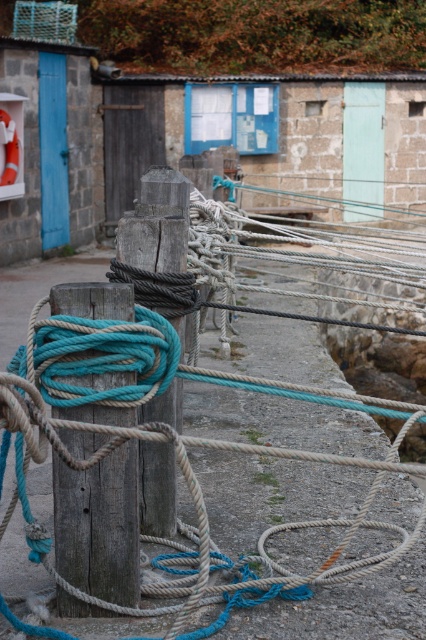
Question: Which point is closer to the camera?

Choices:
 (A) weathered wood post at center
 (B) wooden post at center
 (C) teal rope at center

Answer: (C)

Question: Can you confirm if teal rope at center is positioned to the right of weathered wood post at center?

Choices:
 (A) no
 (B) yes

Answer: (B)

Question: Which object is farther from the camera taking this photo?

Choices:
 (A) weathered wood post at center
 (B) wooden post at center

Answer: (A)

Question: Among these points, which one is nearest to the camera?

Choices:
 (A) (89, 451)
 (B) (178, 220)
 (C) (201, 589)

Answer: (C)

Question: Does wooden post at center have a greater width compared to weathered wood post at center?

Choices:
 (A) no
 (B) yes

Answer: (B)

Question: Is teal rope at center below wooden post at center?

Choices:
 (A) yes
 (B) no

Answer: (A)